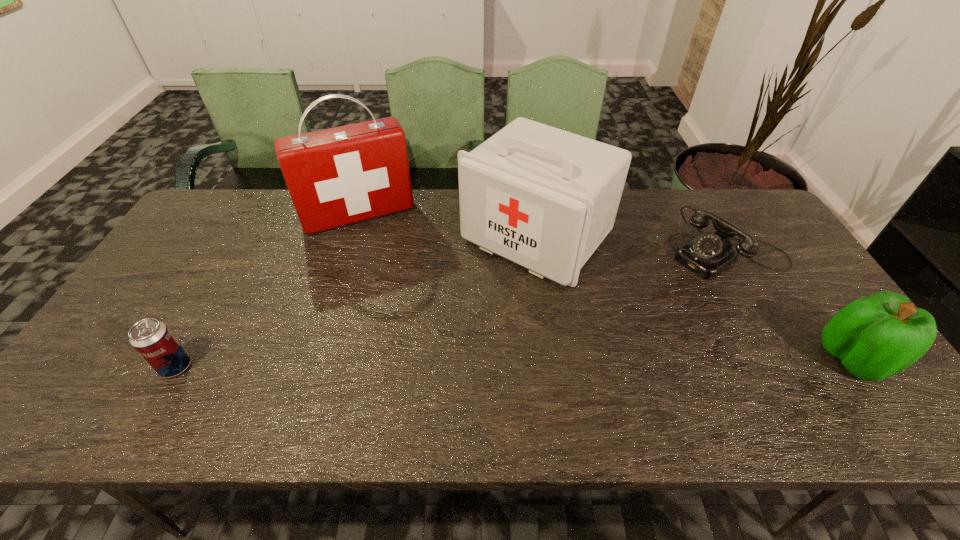
Find the location of a particular element. vacant space on the desktop that is between the leftmost object and the bell pepper and is positioned on the front-facing side of the third object from left to right is located at coordinates (417, 363).

The width and height of the screenshot is (960, 540). What are the coordinates of `vacant space on the desktop that is between the fourth tallest object and the third tallest object and is positioned on the front-facing side of the shortest object` in the screenshot? It's located at (567, 362).

The height and width of the screenshot is (540, 960). In order to click on vacant space on the desktop that is between the second shortest object and the bell pepper and is positioned on the front face of the left first-aid kit in this screenshot , I will do `click(418, 363)`.